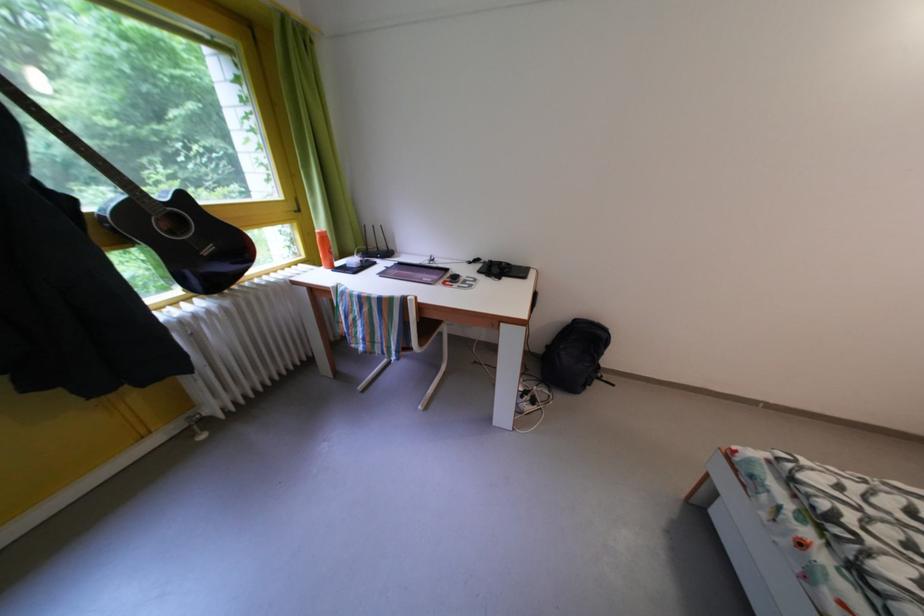
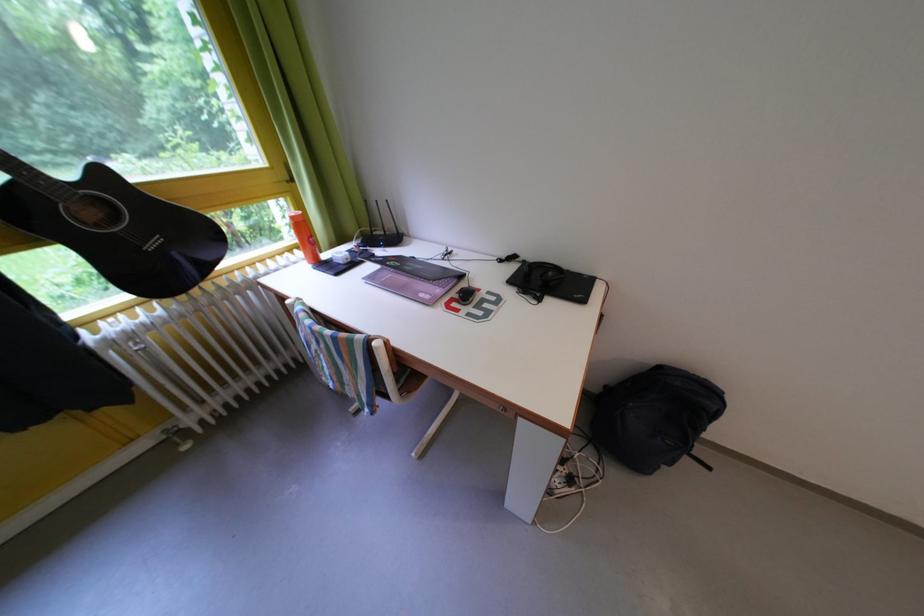
Find the pixel in the second image that matches point 310,272 in the first image.

(305, 257)